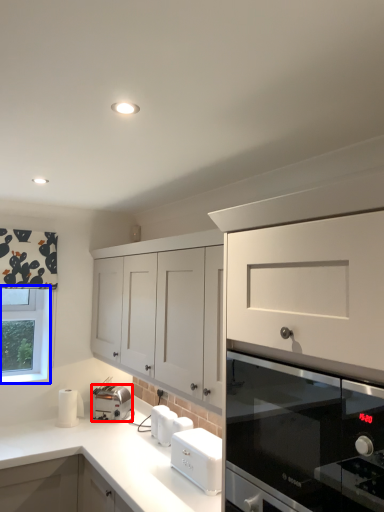
Question: Among these objects, which one is farthest to the camera, kitchen appliance (highlighted by a red box) or window (highlighted by a blue box)?

Choices:
 (A) kitchen appliance
 (B) window

Answer: (B)